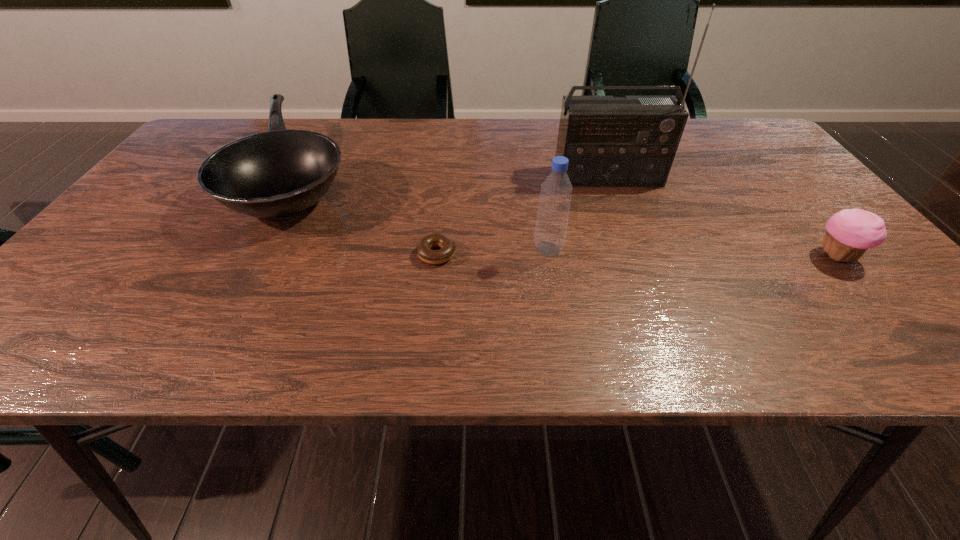
Where is `the fourth object from left to right`? Image resolution: width=960 pixels, height=540 pixels. the fourth object from left to right is located at coordinates (631, 141).

Identify the location of the tallest object. This screenshot has height=540, width=960. [631, 141].

Where is `bottle`? This screenshot has height=540, width=960. bottle is located at coordinates (556, 191).

Find the location of a particular element. The height and width of the screenshot is (540, 960). the fourth shortest object is located at coordinates (556, 191).

Identify the location of the leftmost object. Image resolution: width=960 pixels, height=540 pixels. (280, 173).

Locate an element on the screen. cupcake is located at coordinates (849, 233).

Where is `the shortest object`? This screenshot has height=540, width=960. the shortest object is located at coordinates (424, 247).

The height and width of the screenshot is (540, 960). What are the coordinates of `the fourth object from right to left` in the screenshot? It's located at (424, 247).

Find the location of a particular element. Image resolution: width=960 pixels, height=540 pixels. vacant region located on the front panel of the tallest object is located at coordinates (651, 292).

Identify the location of vacant space situated 0.390m on the right of the third object from left to right. (744, 249).